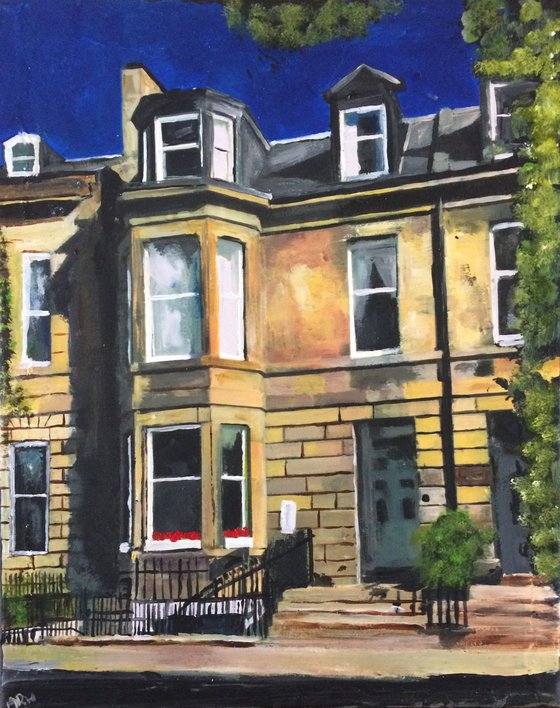
This screenshot has width=560, height=708. Find the location of `large bay window, bottom, left of center and stairs`. large bay window, bottom, left of center and stairs is located at coordinates (144, 484), (193, 481), (246, 486).